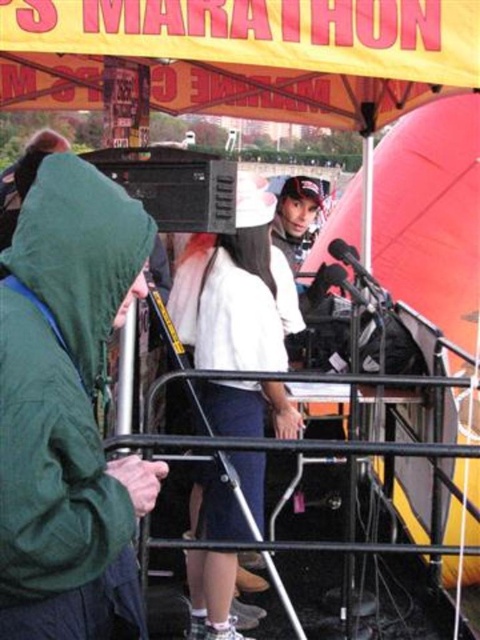
How distant is green matte jacket at left from white fabric shirt at center?

They are 1.37 meters apart.

Who is taller, green matte jacket at left or white fabric shirt at center?

white fabric shirt at center

Which is behind, point (74, 513) or point (229, 532)?

Positioned behind is point (229, 532).

At what (x,y) coordinates should I click in order to perform the action: click on green matte jacket at left. Please return your answer as a coordinate pair (x, y). This screenshot has width=480, height=640. Looking at the image, I should click on (64, 408).